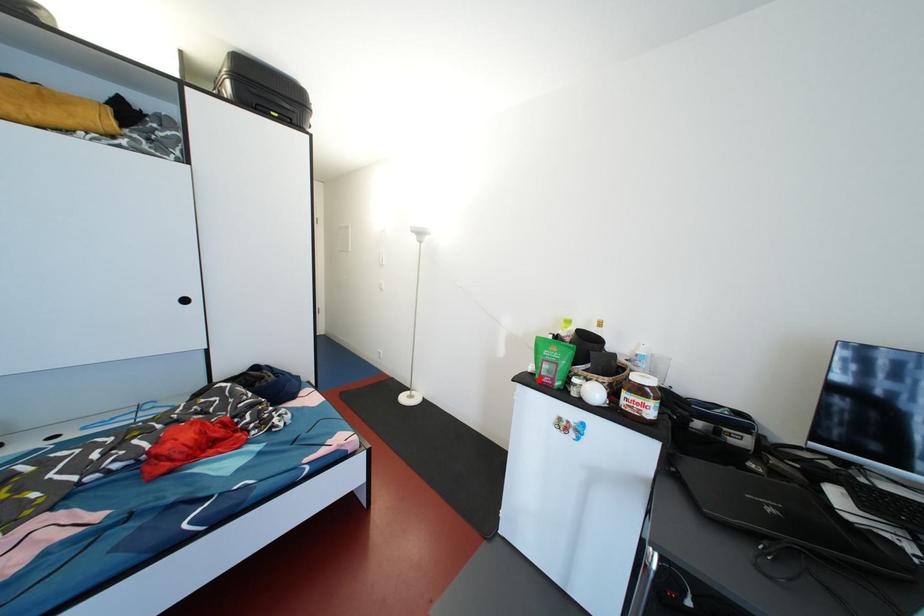
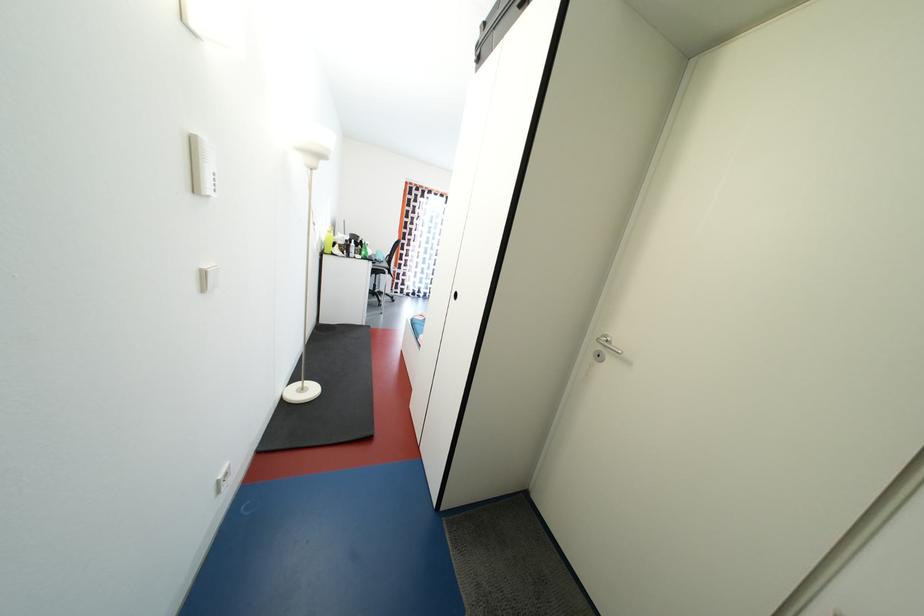
Question: I am providing you with two images of the same scene from different viewpoints. A red point is marked on the first image. Can you still see the location of the red point in image 2?

Choices:
 (A) Yes
 (B) No

Answer: (B)